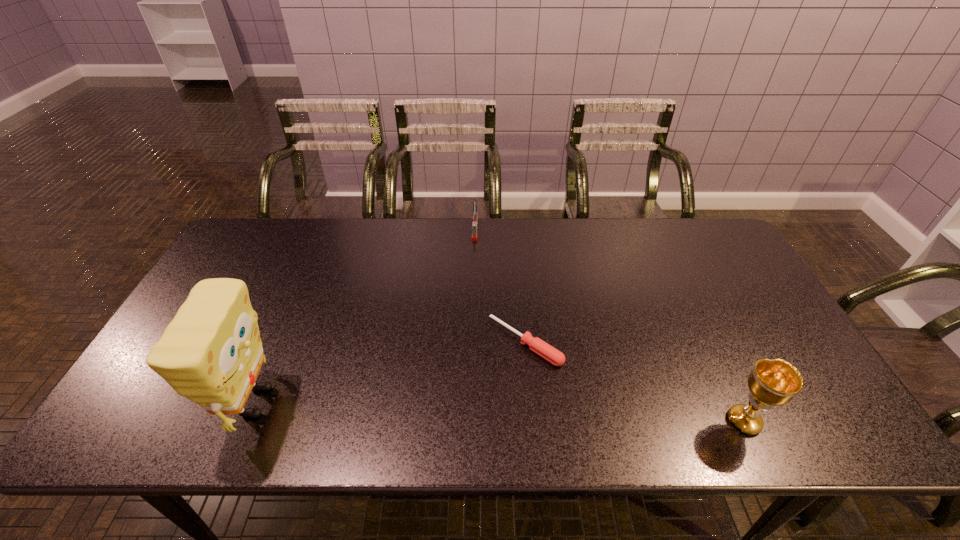
This screenshot has width=960, height=540. I want to click on free space on the desktop that is between the tallest object and the third shortest object and is positioned on the handle side of the stapler, so click(x=464, y=410).

Identify the location of vacant space on the desktop that is between the tallest object and the rightmost object and is positioned at the tip of the screwdriver. This screenshot has width=960, height=540. (456, 410).